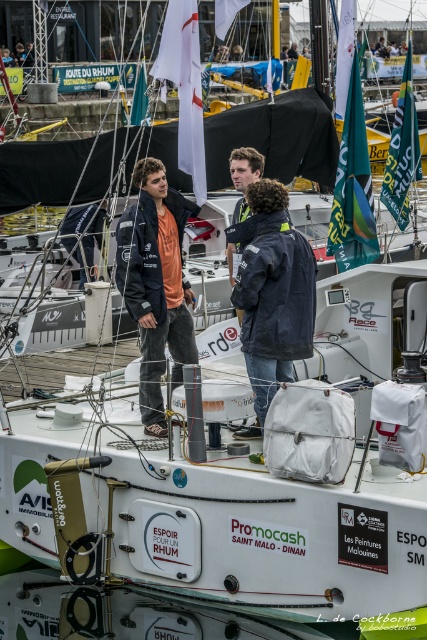
Question: Observing the image, what is the correct spatial positioning of matte black jacket at center in reference to dark blue jacket at center?

Choices:
 (A) above
 (B) below

Answer: (B)

Question: Which object is positioned closest to the matte black jacket at center?

Choices:
 (A) matte orange shirt at center
 (B) dark blue jacket at center

Answer: (A)

Question: Considering the real-world distances, which object is farthest from the matte orange shirt at center?

Choices:
 (A) dark blue jacket at center
 (B) matte black jacket at center

Answer: (A)

Question: Which object is positioned closest to the matte black jacket at center?

Choices:
 (A) matte orange shirt at center
 (B) dark blue jacket at center

Answer: (A)

Question: Does matte black jacket at center have a lesser width compared to matte orange shirt at center?

Choices:
 (A) yes
 (B) no

Answer: (A)

Question: Does matte black jacket at center appear over matte orange shirt at center?

Choices:
 (A) yes
 (B) no

Answer: (B)